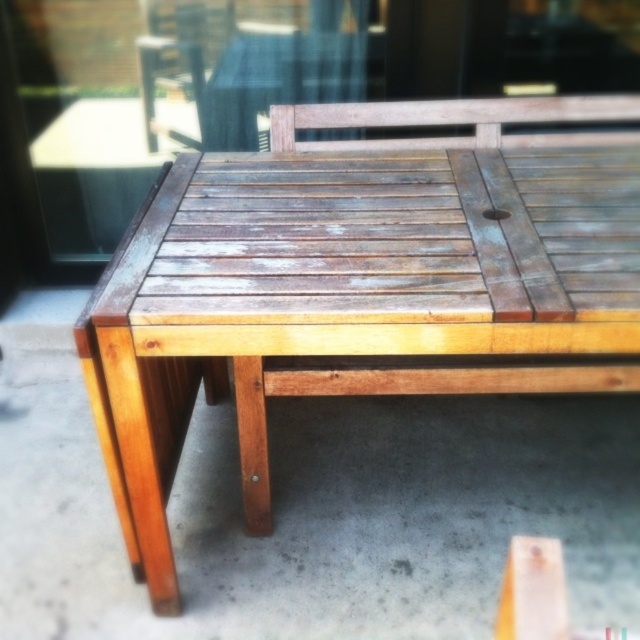
You are standing at the edge of the wooden outdoor table and want to place a small potted plant exactly at the point labeled point (356, 284). Is this point located on the weathered wood picnic table at center?

Yes, the point (356, 284) corresponds to the weathered wood picnic table at center, so placing the potted plant there would be on the table.

You are planning to set up a garden party and need to place a large centerpiece on the table. Which table should you choose between the weathered wood picnic table at center and the transparent wood table at center to ensure the centerpiece is visible from above?

The transparent wood table at center is the better choice because the weathered wood picnic table at center is located below it, allowing the centerpiece to be seen from above.